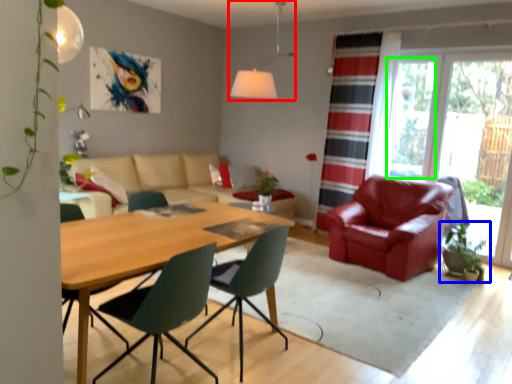
Question: Considering the real-world distances, which object is closest to light fixture (highlighted by a red box)? houseplant (highlighted by a blue box) or window screen (highlighted by a green box).

Choices:
 (A) houseplant
 (B) window screen

Answer: (B)